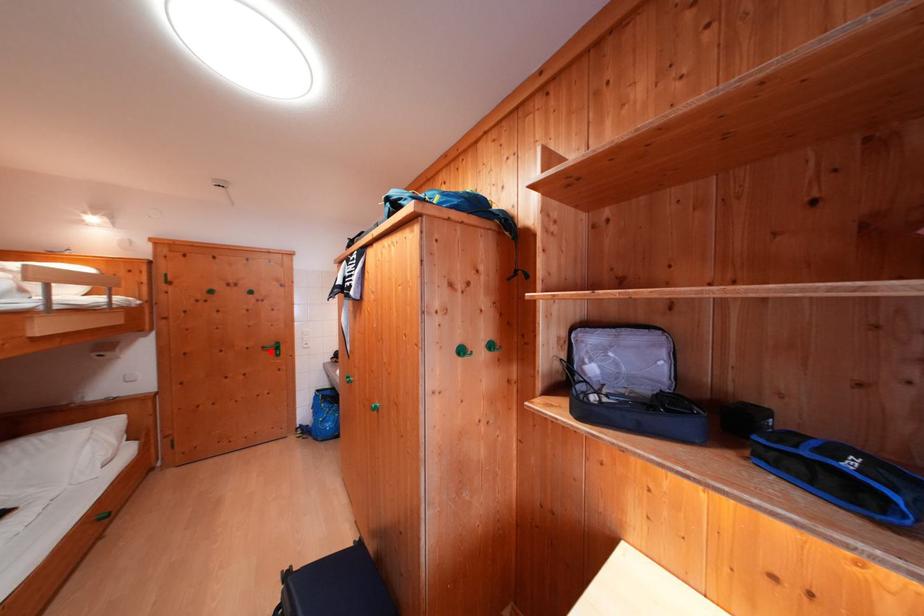
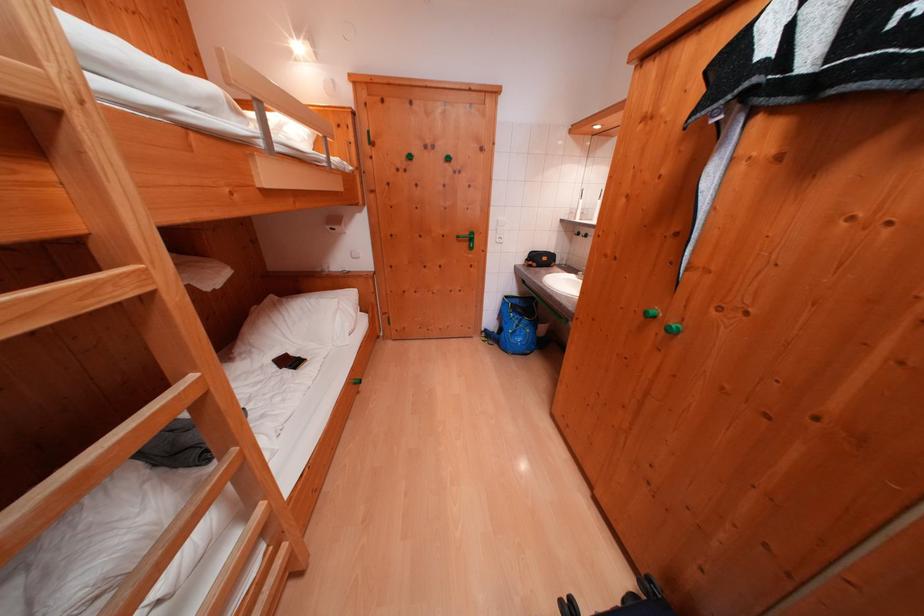
In the second image, find the point that corresponds to the highlighted location in the first image.

(466, 241)